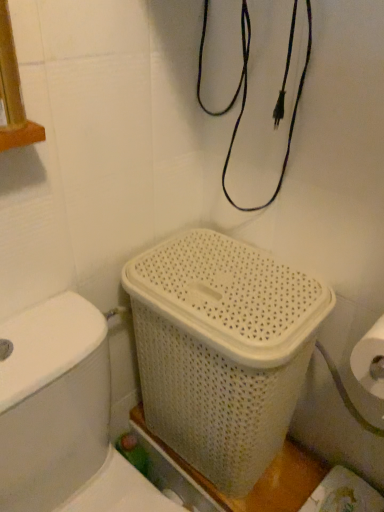
Question: Considering their positions, is white woven basket at center located in front of or behind white plastic toilet at lower left?

Choices:
 (A) behind
 (B) front

Answer: (A)

Question: Considering the positions of white woven basket at center and white plastic toilet at lower left in the image, is white woven basket at center bigger or smaller than white plastic toilet at lower left?

Choices:
 (A) small
 (B) big

Answer: (A)

Question: Does point (254, 458) appear closer or farther from the camera than point (11, 403)?

Choices:
 (A) closer
 (B) farther

Answer: (B)

Question: From the image's perspective, is white plastic toilet at lower left above or below white woven basket at center?

Choices:
 (A) above
 (B) below

Answer: (B)

Question: Does point (76, 470) appear closer or farther from the camera than point (299, 286)?

Choices:
 (A) farther
 (B) closer

Answer: (A)

Question: In terms of size, does white plastic toilet at lower left appear bigger or smaller than white woven basket at center?

Choices:
 (A) big
 (B) small

Answer: (A)

Question: Considering their positions, is white plastic toilet at lower left located in front of or behind white woven basket at center?

Choices:
 (A) behind
 (B) front

Answer: (B)